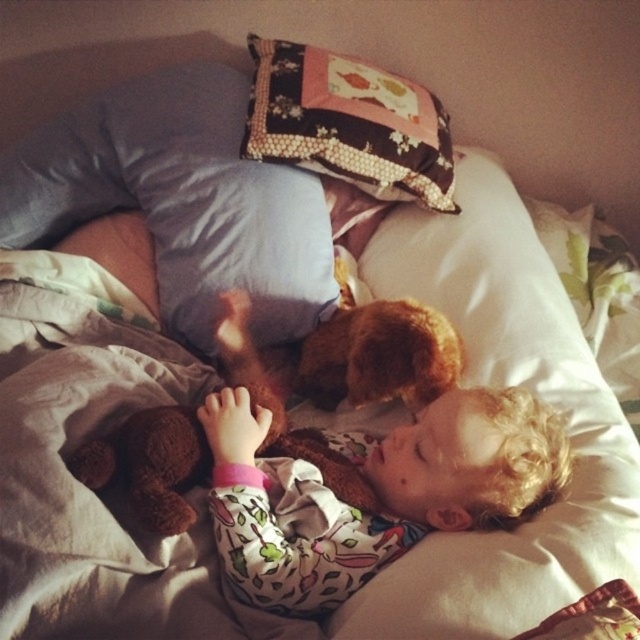
Question: Is fluffy brown teddy bear at center bigger than patchwork fabric pillow at upper center?

Choices:
 (A) no
 (B) yes

Answer: (A)

Question: Which object is farther from the camera taking this photo?

Choices:
 (A) fluffy brown teddy bear at center
 (B) patchwork fabric pillow at upper center

Answer: (B)

Question: Considering the relative positions of fluffy fabric pillow at upper center and fluffy brown teddy bear at center in the image provided, where is fluffy fabric pillow at upper center located with respect to fluffy brown teddy bear at center?

Choices:
 (A) below
 (B) above

Answer: (B)

Question: Among these points, which one is farthest from the camera?

Choices:
 (A) (112, 176)
 (B) (412, 180)
 (C) (310, 552)

Answer: (B)

Question: Does fluffy fabric pillow at upper center appear under fluffy brown teddy bear at center?

Choices:
 (A) yes
 (B) no

Answer: (B)

Question: Which point is closer to the camera?

Choices:
 (A) (170, 188)
 (B) (362, 525)

Answer: (B)